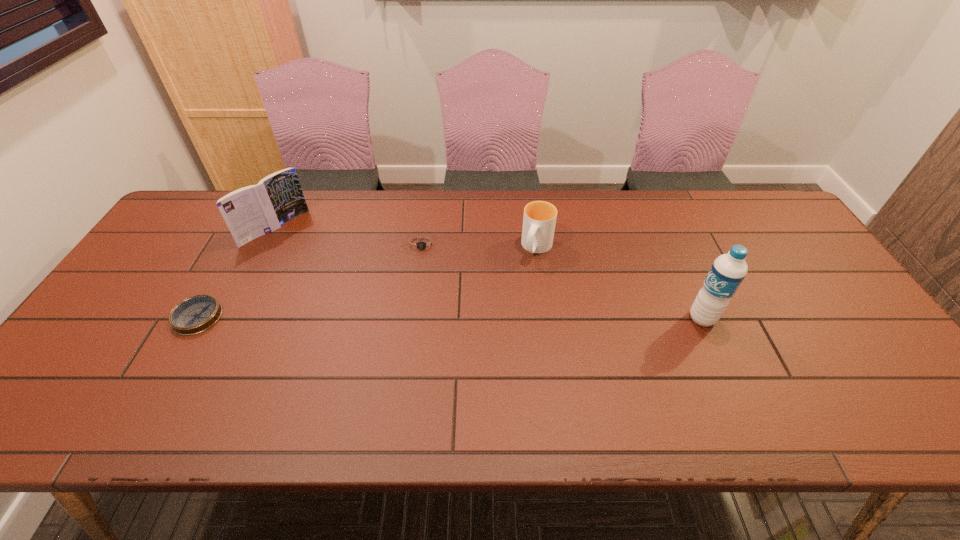
Where is `vacant space located on the label of the water bottle`? The image size is (960, 540). vacant space located on the label of the water bottle is located at coordinates (594, 319).

Find the location of a particular element. vacant space located on the face of the third object from right to left is located at coordinates (423, 291).

I want to click on vacant region located on the face of the third object from right to left, so click(423, 296).

At what (x,y) coordinates should I click in order to perform the action: click on vacant area situated 0.310m on the face of the third object from right to left. Please return your answer as a coordinate pair (x, y). The width and height of the screenshot is (960, 540). Looking at the image, I should click on (425, 346).

Where is `vacant space situated 0.390m with the handle on the side of the cup`? The height and width of the screenshot is (540, 960). vacant space situated 0.390m with the handle on the side of the cup is located at coordinates 484,373.

Identify the location of free space located 0.110m with the handle on the side of the cup. This screenshot has width=960, height=540. (521, 289).

You are a GUI agent. You are given a task and a screenshot of the screen. Output one action in this format:
    pyautogui.click(x=<x>, y=<y>)
    Task: Click on the free space located 0.050m with the handle on the side of the cup
    This screenshot has height=540, width=960.
    Given the screenshot: What is the action you would take?
    pos(528,275)

Locate an element on the screen. blank space located on the front cover of the book is located at coordinates (309, 259).

This screenshot has width=960, height=540. Find the location of `blank area located on the front cover of the book`. blank area located on the front cover of the book is located at coordinates (325, 272).

The width and height of the screenshot is (960, 540). In order to click on blank space located 0.160m on the front cover of the book in this screenshot , I will do `click(320, 267)`.